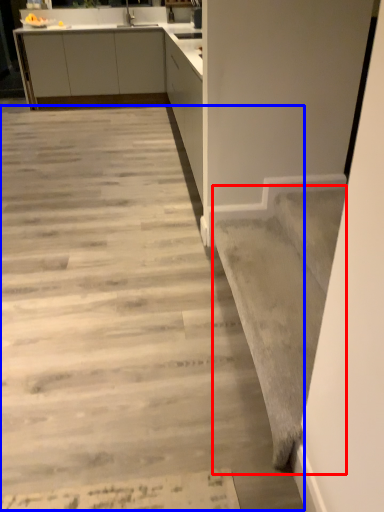
Question: Which of the following is the closest to the observer, stairwell (highlighted by a red box) or concrete (highlighted by a blue box)?

Choices:
 (A) stairwell
 (B) concrete

Answer: (B)